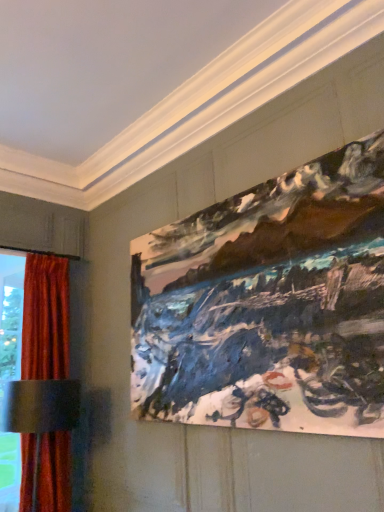
Question: Should I look upward or downward to see painted canvas at upper right?

Choices:
 (A) up
 (B) down

Answer: (B)

Question: Is painted canvas at upper right at the right side of velvet red curtain at left?

Choices:
 (A) no
 (B) yes

Answer: (B)

Question: From a real-world perspective, is painted canvas at upper right over velvet red curtain at left?

Choices:
 (A) yes
 (B) no

Answer: (A)

Question: Can velvet red curtain at left be found inside painted canvas at upper right?

Choices:
 (A) yes
 (B) no

Answer: (B)

Question: Does painted canvas at upper right come in front of velvet red curtain at left?

Choices:
 (A) no
 (B) yes

Answer: (B)

Question: Considering the relative sizes of painted canvas at upper right and velvet red curtain at left in the image provided, is painted canvas at upper right bigger than velvet red curtain at left?

Choices:
 (A) no
 (B) yes

Answer: (A)

Question: From a real-world perspective, is painted canvas at upper right positioned under velvet red curtain at left based on gravity?

Choices:
 (A) yes
 (B) no

Answer: (B)

Question: Is velvet red curtain at left positioned behind painted canvas at upper right?

Choices:
 (A) no
 (B) yes

Answer: (B)

Question: Considering the relative positions of velvet red curtain at left and painted canvas at upper right in the image provided, is velvet red curtain at left in front of painted canvas at upper right?

Choices:
 (A) no
 (B) yes

Answer: (A)

Question: Can you confirm if velvet red curtain at left is taller than painted canvas at upper right?

Choices:
 (A) yes
 (B) no

Answer: (A)

Question: Does velvet red curtain at left turn towards painted canvas at upper right?

Choices:
 (A) no
 (B) yes

Answer: (A)

Question: Is velvet red curtain at left to the right of painted canvas at upper right from the viewer's perspective?

Choices:
 (A) no
 (B) yes

Answer: (A)

Question: Can you confirm if velvet red curtain at left is bigger than painted canvas at upper right?

Choices:
 (A) yes
 (B) no

Answer: (A)

Question: Based on their sizes in the image, would you say velvet red curtain at left is bigger or smaller than painted canvas at upper right?

Choices:
 (A) big
 (B) small

Answer: (A)